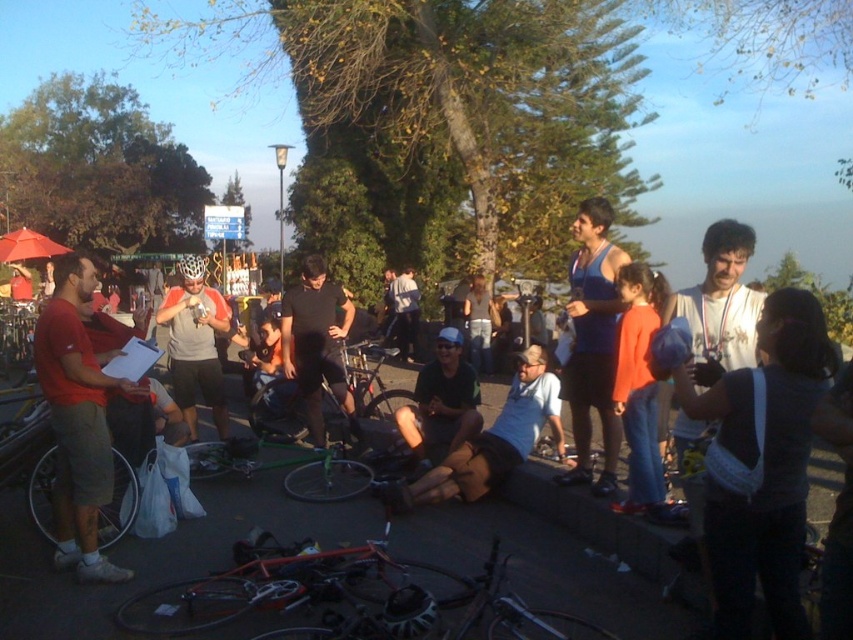
You are a photographer at the event and want to capture a photo of both the blue tank top at center and the matte gray helmet at center. Which object should you focus on first if you want to include both in the frame without moving the camera?

The blue tank top at center is positioned on the right side of the matte gray helmet at center. Since they are both at the center, you can focus on either one first as they are close to each other, but ensure the camera frame includes both by centering the composition between them.

You are organizing a cycling event and need to ensure participants have enough space to store their gear. You notice the blue tank top at center and the matte gray helmet at center. Which item takes up more horizontal space?

The matte gray helmet at center takes up more horizontal space since it has a greater width than the blue tank top at center.

You are a photographer positioned at the center of the scene. You want to take a photo that includes both the red matte bicycle at lower center and the matte black bicycle at left. Which bicycle should you pan your camera to the right to include in the frame?

To include both the red matte bicycle at lower center and the matte black bicycle at left in the frame, you should pan your camera to the right because the red matte bicycle at lower center is to the right of the matte black bicycle at left.